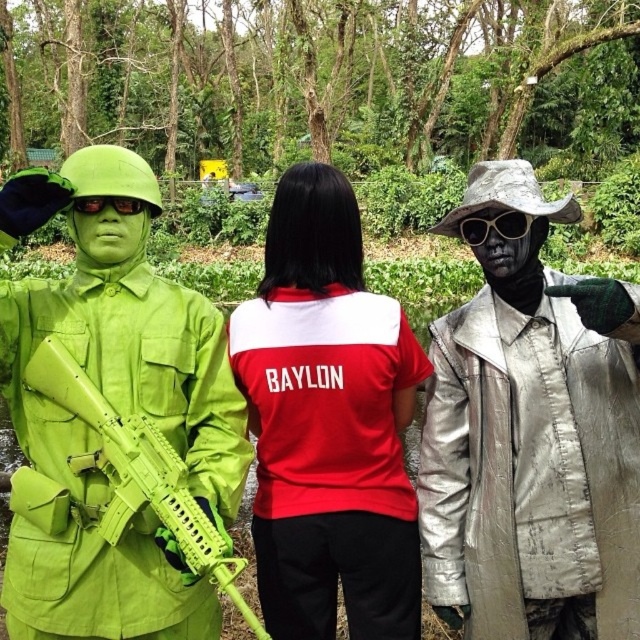
Question: Is lime green fabric uniform at left to the right of red matte shirt at center from the viewer's perspective?

Choices:
 (A) yes
 (B) no

Answer: (B)

Question: Does metallic silver jacket at right appear under red matte shirt at center?

Choices:
 (A) no
 (B) yes

Answer: (A)

Question: Which point is farther to the camera?

Choices:
 (A) metallic silver jacket at right
 (B) red matte shirt at center

Answer: (B)

Question: Is lime green fabric uniform at left to the right of red matte shirt at center from the viewer's perspective?

Choices:
 (A) no
 (B) yes

Answer: (A)

Question: Estimate the real-world distances between objects in this image. Which object is farther from the metallic silver jacket at right?

Choices:
 (A) red matte shirt at center
 (B) lime green fabric uniform at left

Answer: (B)

Question: Which of these objects is positioned farthest from the lime green fabric uniform at left?

Choices:
 (A) red matte shirt at center
 (B) metallic silver jacket at right

Answer: (B)